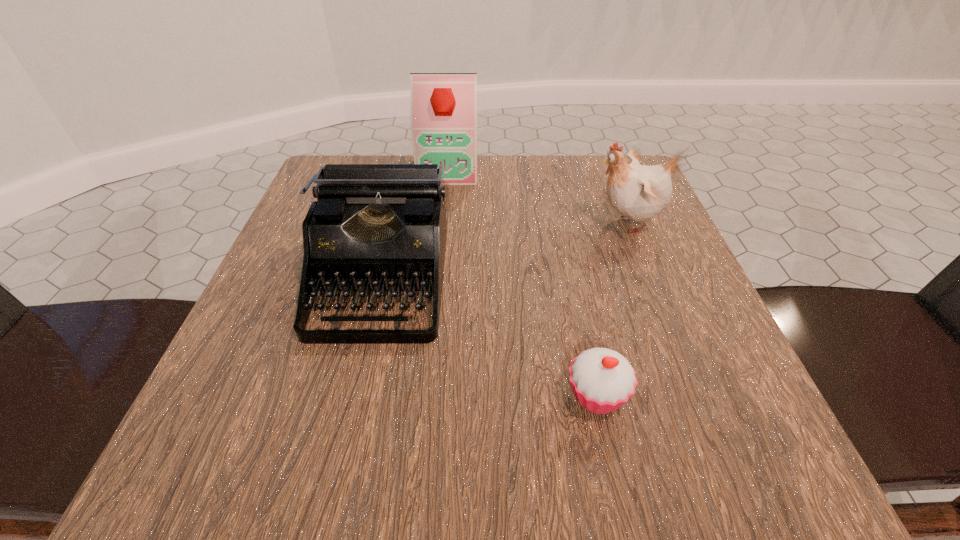
This screenshot has height=540, width=960. Find the location of `free space between the third shortest object and the third tallest object`. free space between the third shortest object and the third tallest object is located at coordinates (503, 251).

Where is `vacant area that lies between the third object from left to right and the tallest object`? The height and width of the screenshot is (540, 960). vacant area that lies between the third object from left to right and the tallest object is located at coordinates click(522, 282).

Where is `vacant space in between the cupcake and the farthest object`? Image resolution: width=960 pixels, height=540 pixels. vacant space in between the cupcake and the farthest object is located at coordinates (522, 282).

Find the location of `object that can be found as the second closest to the third object from left to right`. object that can be found as the second closest to the third object from left to right is located at coordinates (639, 192).

Identify which object is located as the third nearest to the typewriter. Please provide its 2D coordinates. Your answer should be formatted as a tuple, i.e. [(x, y)], where the tuple contains the x and y coordinates of a point satisfying the conditions above.

[(639, 192)]

In order to click on vacant space that satisfies the following two spatial constraints: 1. with the cap open on the shortest object; 2. on the right side of the tallest object in this screenshot , I will do `click(426, 395)`.

I want to click on free space that satisfies the following two spatial constraints: 1. on the typing side of the cupcake; 2. on the right side of the typewriter, so click(x=351, y=395).

You are a GUI agent. You are given a task and a screenshot of the screen. Output one action in this format:
    pyautogui.click(x=<x>, y=<y>)
    Task: Click on the vacant point that satisfies the following two spatial constraints: 1. with the cap open on the cupcake; 2. on the right side of the soya milk
    This screenshot has height=540, width=960.
    Given the screenshot: What is the action you would take?
    pyautogui.click(x=426, y=395)

Identify the location of free spot that satisfies the following two spatial constraints: 1. with the cap open on the farthest object; 2. on the right side of the shortest object. The image size is (960, 540). (426, 395).

This screenshot has height=540, width=960. I want to click on free space that satisfies the following two spatial constraints: 1. on the typing side of the third tallest object; 2. on the right side of the cupcake, so click(351, 395).